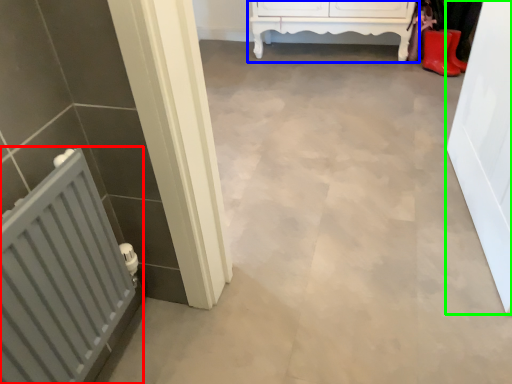
Question: Considering the real-world distances, which object is closest to radiator (highlighted by a red box)? furniture (highlighted by a blue box) or door (highlighted by a green box).

Choices:
 (A) furniture
 (B) door

Answer: (B)